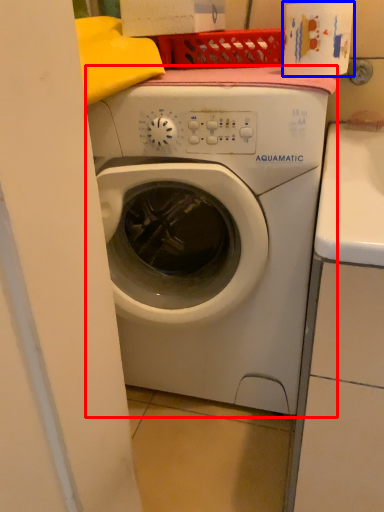
Question: Among these objects, which one is nearest to the camera, washing machine (highlighted by a red box) or toilet paper (highlighted by a blue box)?

Choices:
 (A) washing machine
 (B) toilet paper

Answer: (A)